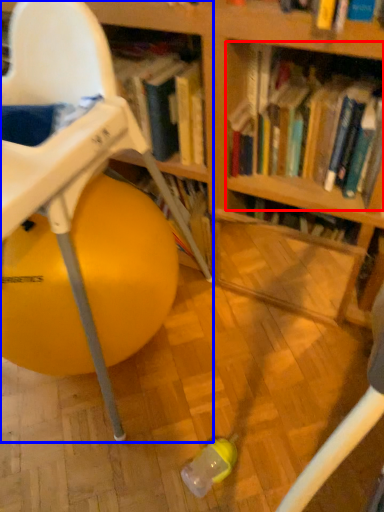
Question: Among these objects, which one is farthest to the camera, book (highlighted by a red box) or chair (highlighted by a blue box)?

Choices:
 (A) book
 (B) chair

Answer: (A)